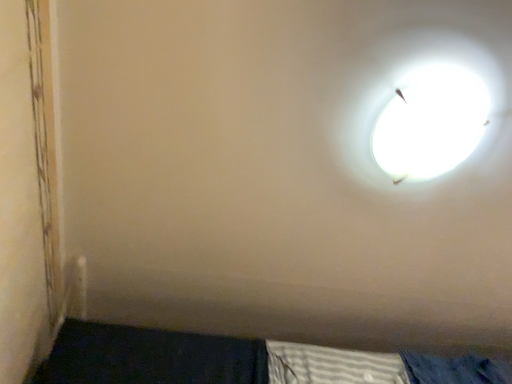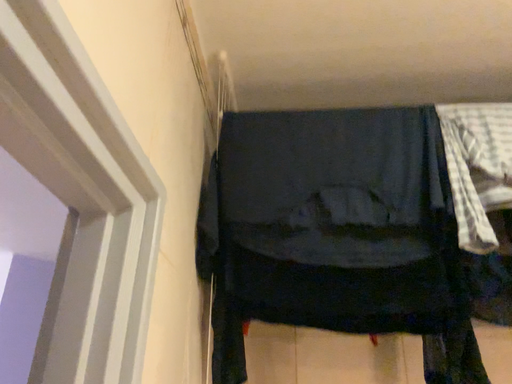
Question: How did the camera likely rotate when shooting the video?

Choices:
 (A) rotated right
 (B) rotated left

Answer: (B)